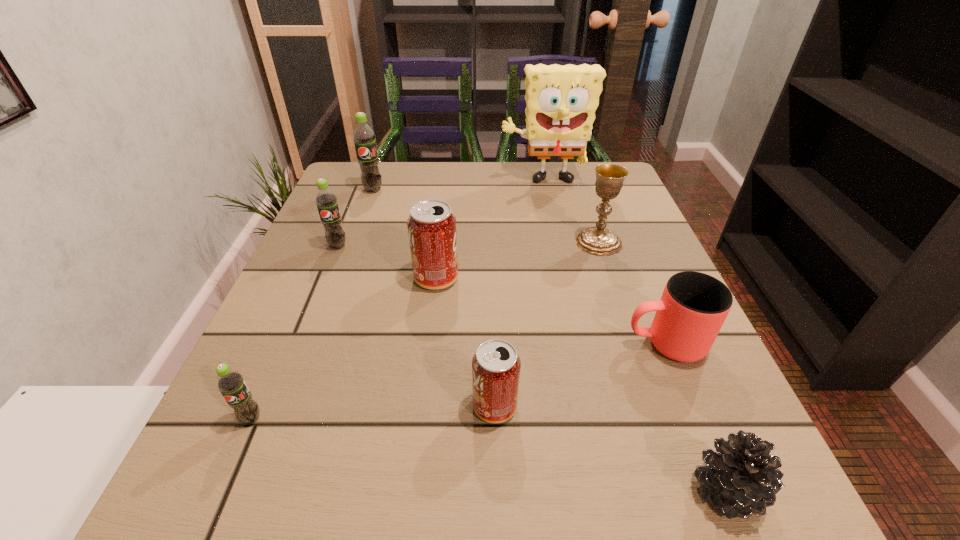
You are a GUI agent. You are given a task and a screenshot of the screen. Output one action in this format:
    pyautogui.click(x=<x>, y=<y>)
    Task: Click on the yellow sponge
    
    Given the screenshot: What is the action you would take?
    561,101

Where is `the tallest object`? The image size is (960, 540). the tallest object is located at coordinates (561, 101).

Identify the location of the biggest green soda. (363, 136).

Where is `the farthest green soda`? The width and height of the screenshot is (960, 540). the farthest green soda is located at coordinates (363, 136).

The image size is (960, 540). I want to click on chalice, so click(x=598, y=240).

Identify the location of the second biggest green soda. This screenshot has width=960, height=540. (326, 201).

You are a GUI agent. You are given a task and a screenshot of the screen. Output one action in this format:
    pyautogui.click(x=<x>, y=<y>)
    Task: Click on the second farthest green soda
    This screenshot has width=960, height=540.
    Given the screenshot: What is the action you would take?
    pyautogui.click(x=326, y=201)

Image resolution: width=960 pixels, height=540 pixels. What are the coordinates of `the bigger red soda can` in the screenshot? It's located at (432, 232).

In order to click on the left red soda can in this screenshot , I will do `click(432, 232)`.

Locate an element on the screen. pink cup is located at coordinates (693, 307).